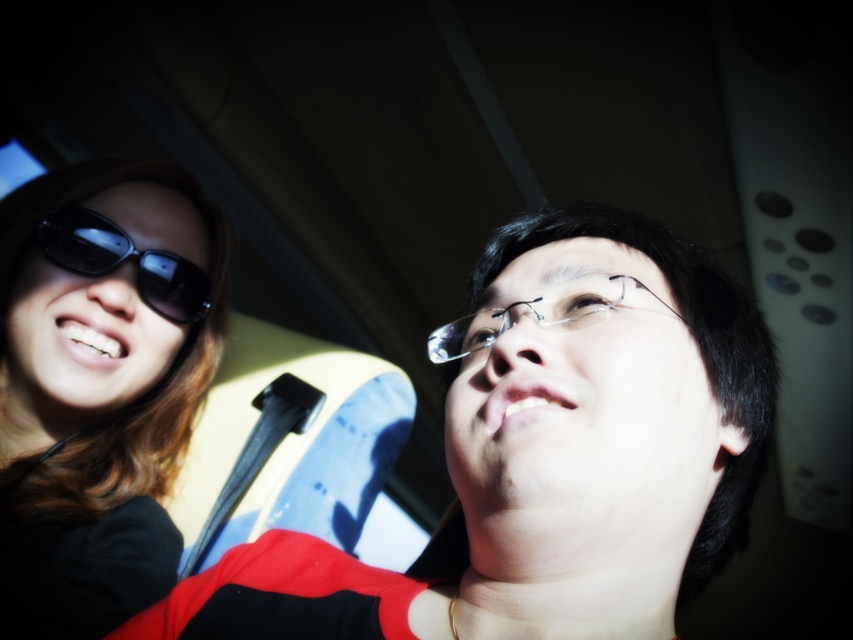
You are a photographer trying to capture the matte black sunglasses at upper left and the sunglasses at left in a photo. Which of these two sunglasses is located below the other?

The matte black sunglasses at upper left is positioned under the sunglasses at left, so the matte black sunglasses at upper left is below the sunglasses at left.

You are a passenger in a vehicle and want to retrieve your sunglasses which are located at point (100, 392). Based on the scene description, which object at this coordinate is your sunglasses?

The sunglasses at left is located at point (100, 392).